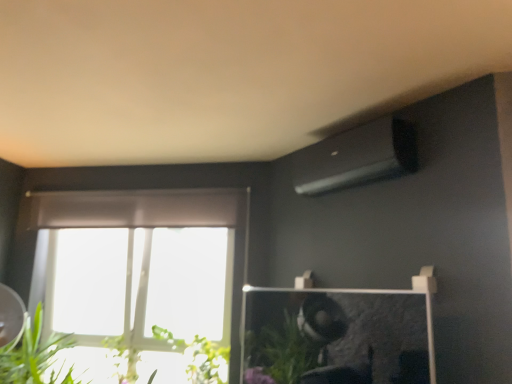
Question: From a real-world perspective, is green leafy plant at lower left, the second plant viewed from the left, on top of green leafy plant at lower left?

Choices:
 (A) no
 (B) yes

Answer: (A)

Question: Is the position of green leafy plant at lower left, the second plant viewed from the left, less distant than that of green leafy plant at lower left?

Choices:
 (A) no
 (B) yes

Answer: (A)

Question: Considering the relative sizes of green leafy plant at lower left, the second plant viewed from the left, and green leafy plant at lower left in the image provided, is green leafy plant at lower left, the second plant viewed from the left, taller than green leafy plant at lower left?

Choices:
 (A) yes
 (B) no

Answer: (B)

Question: Is green leafy plant at lower left, placed as the 1th plant when sorted from right to left, further to the viewer compared to green leafy plant at lower left?

Choices:
 (A) no
 (B) yes

Answer: (B)

Question: Is green leafy plant at lower left, the second plant viewed from the left, facing towards green leafy plant at lower left?

Choices:
 (A) yes
 (B) no

Answer: (B)

Question: Considering the positions of green leafy plant at lower left, the second plant viewed from the left, and green leafy plant at lower left, which is counted as the 2th plant, starting from the right, in the image, is green leafy plant at lower left, the second plant viewed from the left, wider or thinner than green leafy plant at lower left, which is counted as the 2th plant, starting from the right,?

Choices:
 (A) wide
 (B) thin

Answer: (A)

Question: Considering their positions, is green leafy plant at lower left, the second plant viewed from the left, located in front of or behind green leafy plant at lower left, which is counted as the 2th plant, starting from the right?

Choices:
 (A) front
 (B) behind

Answer: (A)

Question: Does point (161, 331) appear closer or farther from the camera than point (134, 354)?

Choices:
 (A) farther
 (B) closer

Answer: (A)

Question: Is green leafy plant at lower left, placed as the 1th plant when sorted from right to left, taller or shorter than green leafy plant at lower left, which is counted as the 2th plant, starting from the right?

Choices:
 (A) short
 (B) tall

Answer: (B)

Question: Is green leafy plant at lower left bigger or smaller than green leafy plant at lower left, placed as the 1th plant when sorted from right to left?

Choices:
 (A) small
 (B) big

Answer: (B)

Question: From a real-world perspective, is green leafy plant at lower left above or below green leafy plant at lower left, the second plant viewed from the left?

Choices:
 (A) below
 (B) above

Answer: (B)

Question: From the image's perspective, is green leafy plant at lower left above or below green leafy plant at lower left, the second plant viewed from the left?

Choices:
 (A) above
 (B) below

Answer: (A)

Question: Looking at their shapes, would you say green leafy plant at lower left is wider or thinner than green leafy plant at lower left, placed as the 1th plant when sorted from right to left?

Choices:
 (A) thin
 (B) wide

Answer: (B)

Question: Looking at their shapes, would you say green leafy plant at lower left, which ranks as the first plant in left-to-right order, is wider or thinner than green leafy plant at lower left, the second plant viewed from the left?

Choices:
 (A) wide
 (B) thin

Answer: (B)

Question: Is green leafy plant at lower left, which is counted as the 2th plant, starting from the right, situated inside green leafy plant at lower left, placed as the 1th plant when sorted from right to left, or outside?

Choices:
 (A) outside
 (B) inside

Answer: (A)